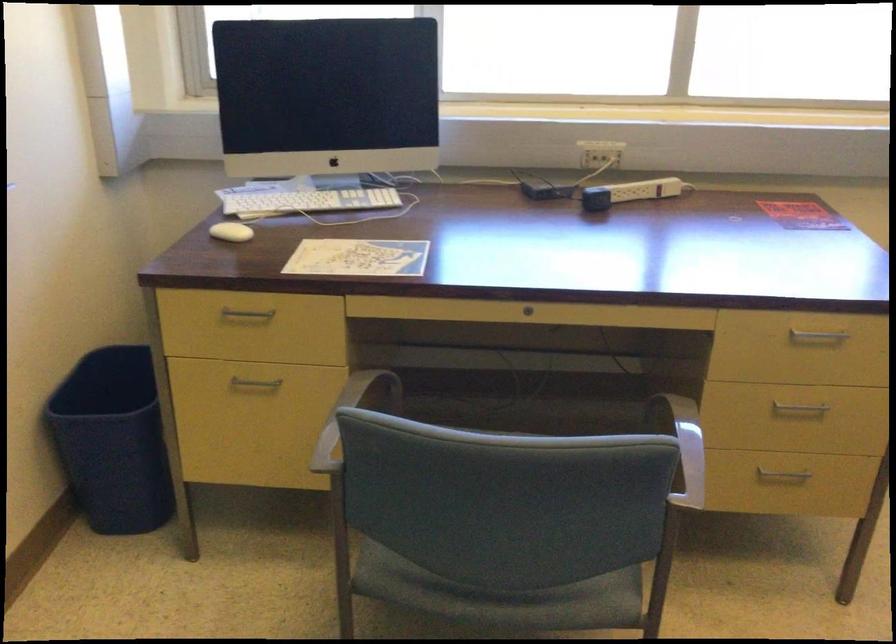
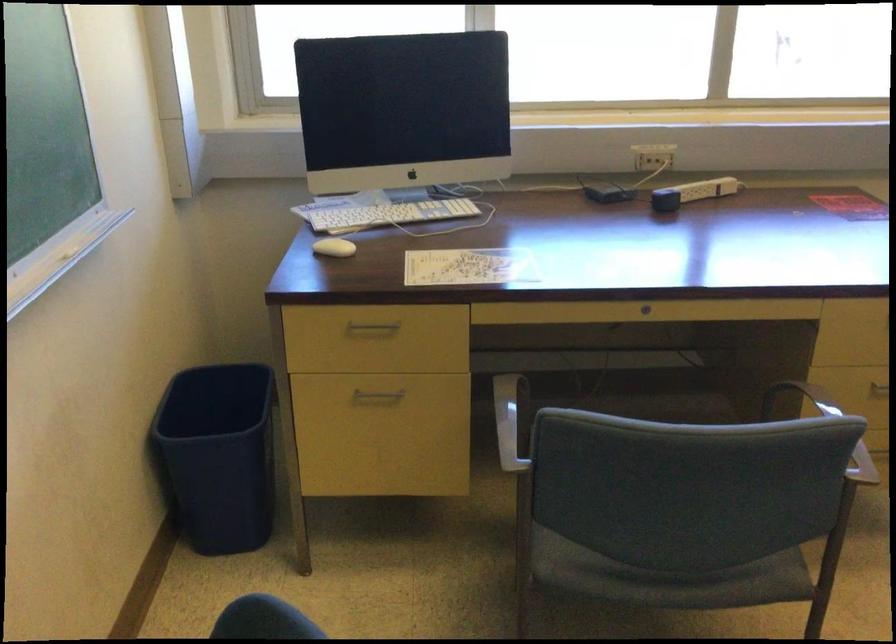
Locate, in the second image, the point that corresponds to (634,450) in the first image.

(825, 427)